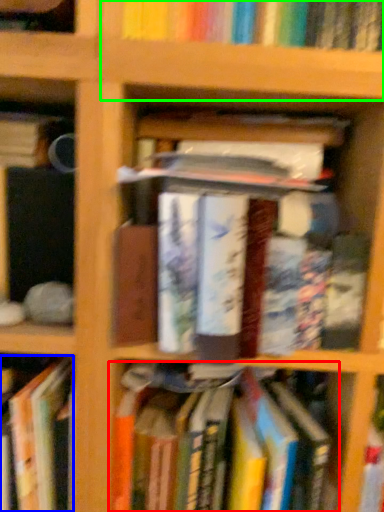
Question: Which object is positioned farthest from book (highlighted by a red box)? Select from book (highlighted by a blue box) and shelf (highlighted by a green box).

Choices:
 (A) book
 (B) shelf

Answer: (B)